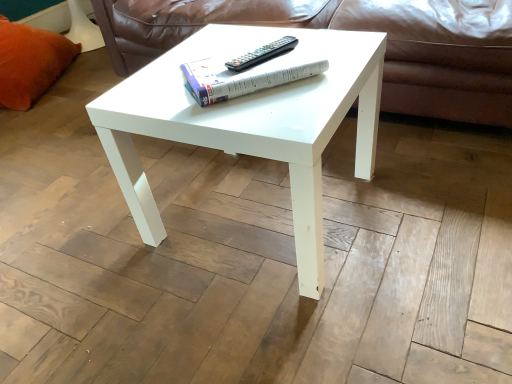
Question: From a real-world perspective, relative to white paper at center, is black plastic remote at center vertically above or below?

Choices:
 (A) below
 (B) above

Answer: (A)

Question: Choose the correct answer: Is black plastic remote at center inside white paper at center or outside it?

Choices:
 (A) outside
 (B) inside

Answer: (B)

Question: Based on their relative distances, which object is nearer to the orange plush pillow at left?

Choices:
 (A) black plastic remote at center
 (B) white glossy coffee table at center
 (C) leather at center
 (D) white paper at center

Answer: (C)

Question: Which is nearer to the orange plush pillow at left?

Choices:
 (A) black plastic remote at center
 (B) white glossy coffee table at center
 (C) leather at center
 (D) white paper at center

Answer: (C)